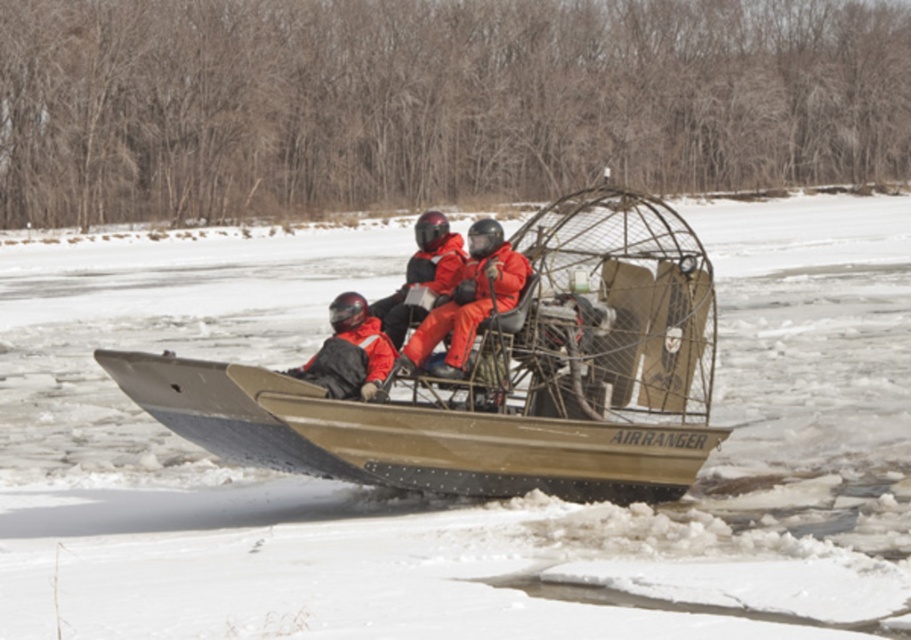
You are a passenger on the AIRRANGER airboat and need to locate two specific points marked on the ice. The first point is at coordinates point (341,312) and the second is at point (421,264). From your perspective on the boat, which point is closer to the front of the airboat?

Point (341,312) is in front of point (421,264), so the first point is closer to the front of the airboat.

You are a passenger on the matte khaki airboat at center and want to know if you can move sideways to pick up an item that fell off the boat. Based on the scene, can the airboat move sideways without getting stuck in the brown matte snow at center?

The brown matte snow at center has a larger width than the matte khaki airboat at center, so the airboat can move sideways without getting stuck as there is enough space around it.

You are a passenger on the AIRRANGER airboat and need to choose between two jackets available in the storage cage at the rear. The jackets are the matte black jacket at center and the orange matte jacket at center. Which jacket would provide better insulation based on their thickness?

The orange matte jacket at center is thicker than the matte black jacket at center, so it would provide better insulation.